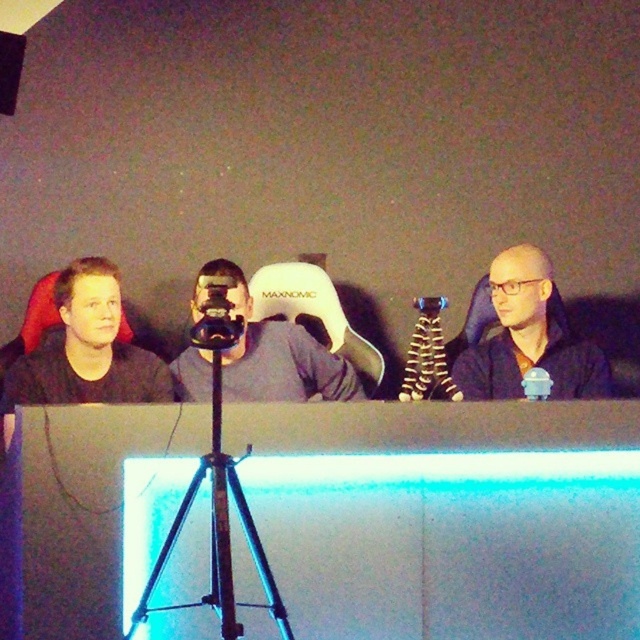
You are a camera operator adjusting the camera angle to focus on the black matte jacket at center and the metallic tripod at center. Which object should you move the camera closer to if you want to ensure both are in frame without zooming?

The black matte jacket at center is to the right of the metallic tripod at center. To keep both in frame without zooming, move the camera closer to the metallic tripod at center so that the black matte jacket at center remains visible to the right of the tripod.

You are a camera operator trying to focus on two specific points in the scene. The first point is at coordinates point (570, 397) and the second is at point (202, 330). Which point is closer to the camera?

Point (570, 397) is closer to the camera than point (202, 330) because it is further to the viewer according to the description.